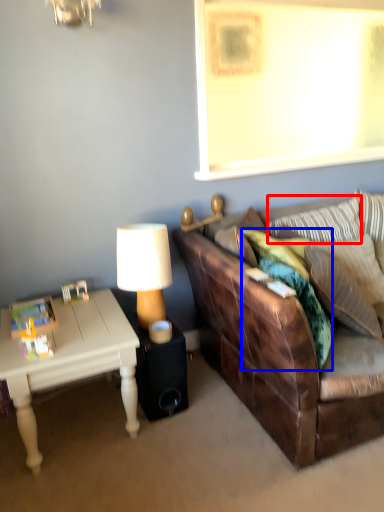
Question: Among these objects, which one is farthest to the camera, pillow (highlighted by a red box) or pillow (highlighted by a blue box)?

Choices:
 (A) pillow
 (B) pillow

Answer: (A)